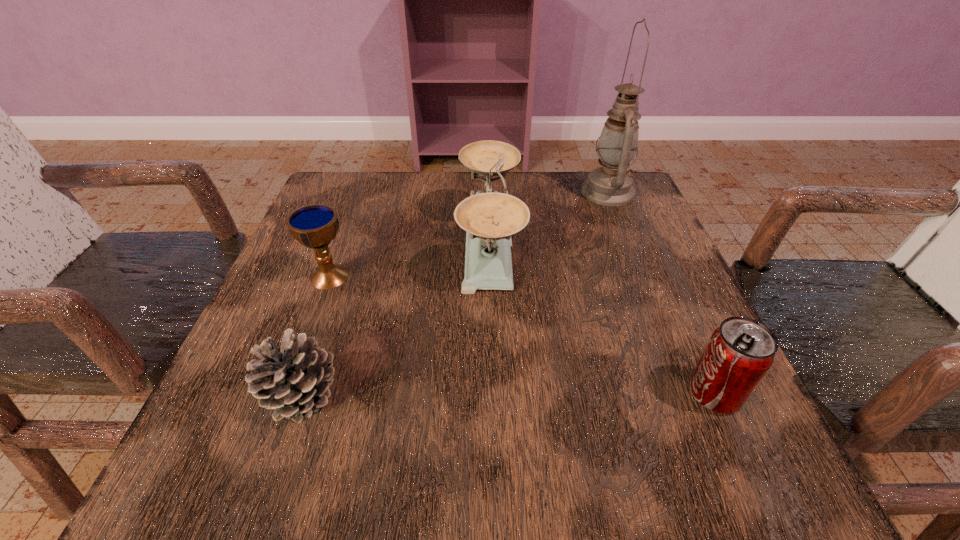
Identify the location of vacant space in between the scale and the pinecone. This screenshot has height=540, width=960. (396, 320).

Identify the location of empty location between the pop soda and the fourth shortest object. (602, 320).

You are a GUI agent. You are given a task and a screenshot of the screen. Output one action in this format:
    pyautogui.click(x=<x>, y=<y>)
    Task: Click on the free point between the scale and the tallest object
    The image size is (960, 540).
    Given the screenshot: What is the action you would take?
    pyautogui.click(x=548, y=219)

The image size is (960, 540). Find the location of `free space between the third object from right to left and the chalice`. free space between the third object from right to left and the chalice is located at coordinates (409, 261).

You are a GUI agent. You are given a task and a screenshot of the screen. Output one action in this format:
    pyautogui.click(x=<x>, y=<y>)
    Task: Click on the free space between the pop soda and the scale
    
    Given the screenshot: What is the action you would take?
    pyautogui.click(x=602, y=320)

Image resolution: width=960 pixels, height=540 pixels. What are the coordinates of `free spot between the chalice and the third object from right to left` in the screenshot? It's located at (409, 261).

The height and width of the screenshot is (540, 960). I want to click on free point between the pop soda and the pinecone, so click(509, 394).

Identify which object is the closest to the pop soda. Please provide its 2D coordinates. Your answer should be formatted as a tuple, i.e. [(x, y)], where the tuple contains the x and y coordinates of a point satisfying the conditions above.

[(489, 218)]

Where is `object that stands as the closest to the tallest object`? Image resolution: width=960 pixels, height=540 pixels. object that stands as the closest to the tallest object is located at coordinates (489, 218).

Where is `vacant space that satisfies the following two spatial constraints: 1. on the front side of the oil lamp; 2. on the right side of the pop soda`? The image size is (960, 540). vacant space that satisfies the following two spatial constraints: 1. on the front side of the oil lamp; 2. on the right side of the pop soda is located at coordinates (689, 393).